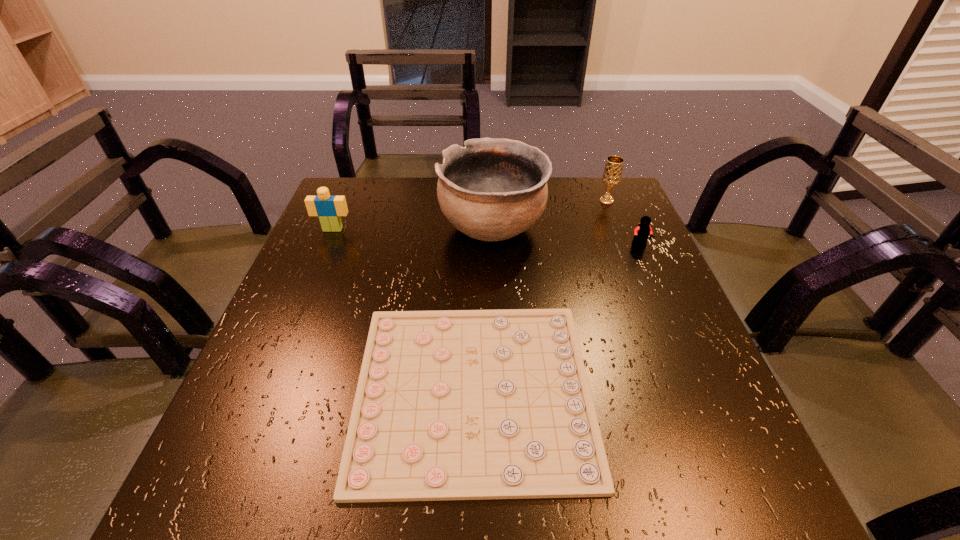
At what (x,y) coordinates should I click in order to perform the action: click on vacant space located 0.280m on the face of the leftmost object. Please return your answer as a coordinate pair (x, y). This screenshot has height=540, width=960. Looking at the image, I should click on (298, 313).

Where is `blank space located on the front-facing side of the shorter Lego`? The image size is (960, 540). blank space located on the front-facing side of the shorter Lego is located at coordinates (681, 340).

This screenshot has height=540, width=960. Identify the location of free space located 0.400m on the back of the shortest object. (476, 206).

You are a GUI agent. You are given a task and a screenshot of the screen. Output one action in this format:
    pyautogui.click(x=<x>, y=<y>)
    Task: Click on the pottery that is positioned at the far edge
    The width and height of the screenshot is (960, 540).
    Given the screenshot: What is the action you would take?
    pyautogui.click(x=492, y=189)

Locate an element on the screen. chalice that is at the far edge is located at coordinates (612, 173).

In order to click on object that is at the near edge in this screenshot , I will do [x=457, y=404].

Where is `object present at the left edge`? This screenshot has height=540, width=960. object present at the left edge is located at coordinates (329, 208).

Find the location of a particular element. chalice that is at the right edge is located at coordinates (612, 173).

Identify the location of Lego present at the right edge. This screenshot has width=960, height=540. (641, 233).

Where is `object present at the far right corner`? This screenshot has width=960, height=540. object present at the far right corner is located at coordinates pyautogui.click(x=612, y=173).